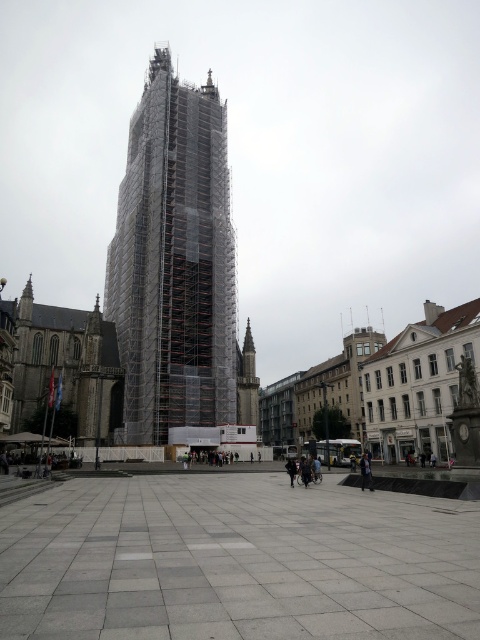
Is scaffolding at center taller than dark blue fabric jacket at lower right?

Indeed, scaffolding at center has a greater height compared to dark blue fabric jacket at lower right.

Is point (188, 202) farther from viewer compared to point (368, 476)?

Yes, point (188, 202) is behind point (368, 476).

Locate an element on the screen. This screenshot has width=480, height=640. scaffolding at center is located at coordinates (173, 262).

Is dark blue fabric jacket at lower right in front of black leather jacket at lower center?

Yes, dark blue fabric jacket at lower right is in front of black leather jacket at lower center.

Does point (367, 481) lie in front of point (288, 458)?

That is True.

You are a GUI agent. You are given a task and a screenshot of the screen. Output one action in this format:
    pyautogui.click(x=<x>, y=<y>)
    Task: Click on the dark blue fabric jacket at lower right
    
    Given the screenshot: What is the action you would take?
    pyautogui.click(x=365, y=472)

Find the location of `gray concrete pavement at center`. gray concrete pavement at center is located at coordinates (237, 561).

Does gray concrete pavement at center have a larger size compared to dark blue fabric jacket at lower right?

Yes.

At what (x,y) coordinates should I click in order to perform the action: click on gray concrete pavement at center. Please return your answer as a coordinate pair (x, y). Looking at the image, I should click on (237, 561).

Identify the location of gray concrete pavement at center. The image size is (480, 640). (237, 561).